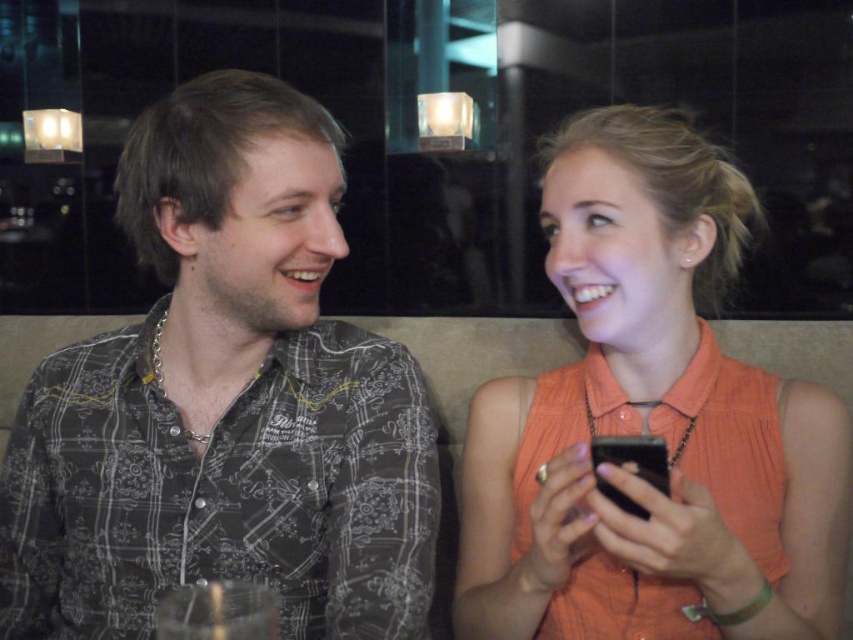
Between orange fabric shirt at center and matte black smartphone at center, which one appears on the left side from the viewer's perspective?

matte black smartphone at center

Describe the element at coordinates (648, 422) in the screenshot. I see `orange fabric shirt at center` at that location.

This screenshot has width=853, height=640. What are the coordinates of `orange fabric shirt at center` in the screenshot? It's located at (648, 422).

Consider the image. Can you confirm if dark gray printed shirt at left is smaller than matte black smartphone at center?

No, dark gray printed shirt at left is not smaller than matte black smartphone at center.

Is dark gray printed shirt at left bigger than matte black smartphone at center?

Indeed, dark gray printed shirt at left has a larger size compared to matte black smartphone at center.

Measure the distance between point (418, 412) and camera.

Point (418, 412) is 82.24 centimeters from camera.

Where is `dark gray printed shirt at left`? Image resolution: width=853 pixels, height=640 pixels. dark gray printed shirt at left is located at coordinates (224, 403).

Who is positioned more to the right, dark gray printed shirt at left or orange fabric shirt at center?

orange fabric shirt at center is more to the right.

Does dark gray printed shirt at left appear on the left side of orange fabric shirt at center?

Correct, you'll find dark gray printed shirt at left to the left of orange fabric shirt at center.

Image resolution: width=853 pixels, height=640 pixels. Find the location of `dark gray printed shirt at left`. dark gray printed shirt at left is located at coordinates (224, 403).